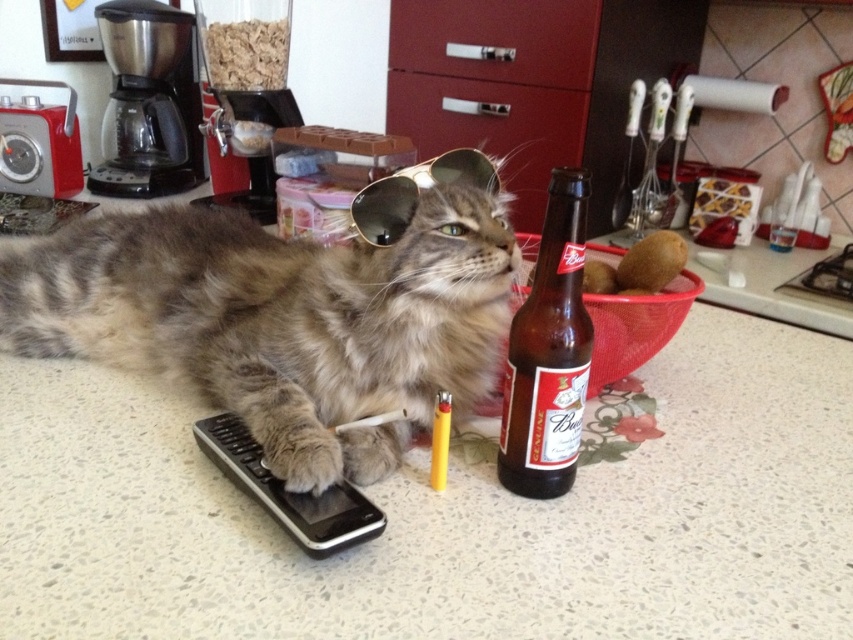
You are a robotic arm that needs to grab the matte red drawer at center without touching the fuzzy fur cat at center. Can you do it?

The fuzzy fur cat at center and the matte red drawer at center are 87.12 centimeters apart from each other. Since the robotic arm can reach the drawer without coming into contact with the cat, it is possible to grab the matte red drawer at center without touching the fuzzy fur cat at center.

You are a cat owner who wants to place a new toy for your fuzzy fur cat at center. The toy is the same size as the black plastic coffee maker at upper left. Will the cat be able to play with the toy without it being too small for them?

The fuzzy fur cat at center is larger in size than the black plastic coffee maker at upper left. Since the toy is the same size as the coffee maker, it might be too small for the cat to play with comfortably.